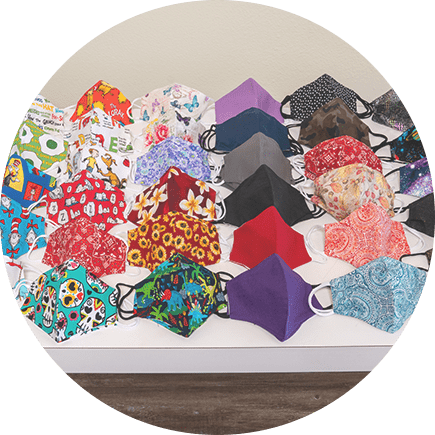
Locate an element on the screen. wood ground is located at coordinates (239, 405).